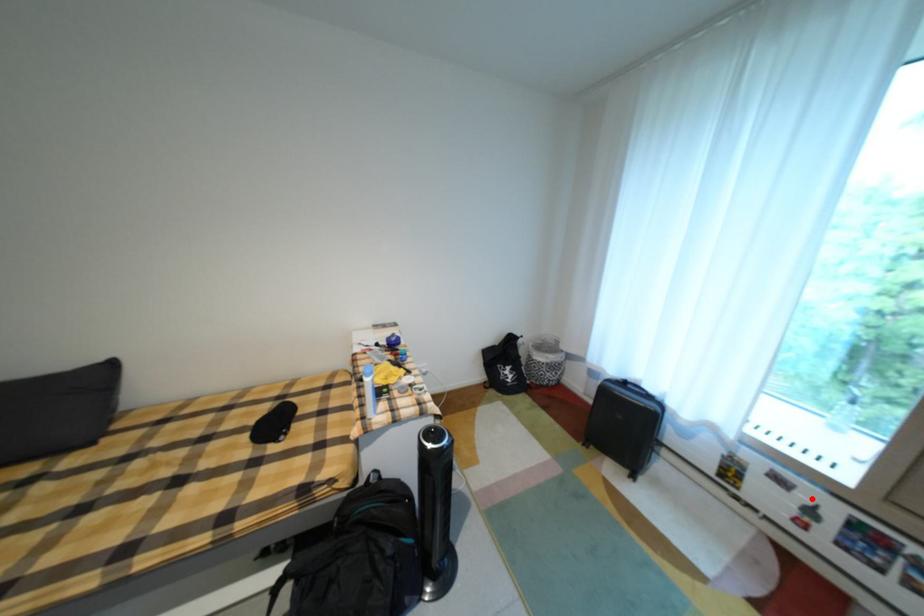
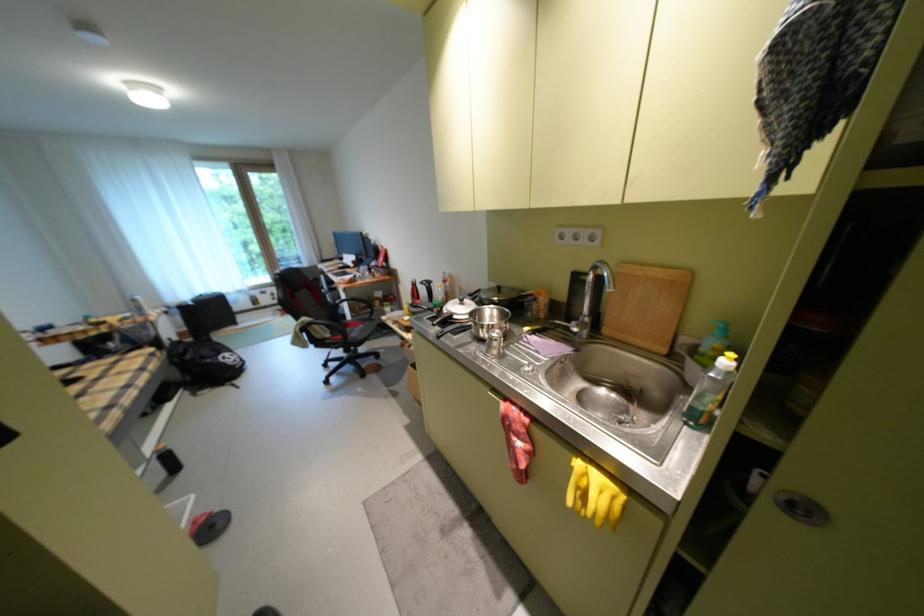
Question: I am providing you with two images of the same scene from different viewpoints. In image1, a red point is highlighted. Considering the same 3D point in image2, which of the following is correct?

Choices:
 (A) It is closer
 (B) It is farther

Answer: (B)